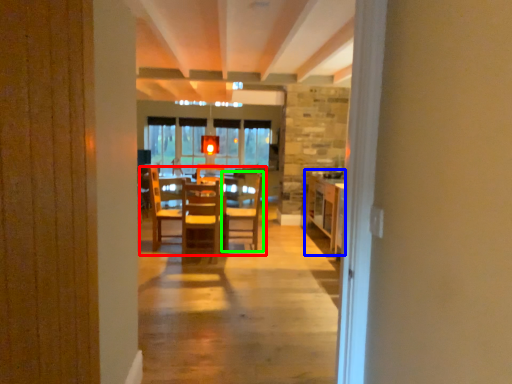
Question: Which object is positioned farthest from table (highlighted by a red box)? Select from table (highlighted by a blue box) and chair (highlighted by a green box).

Choices:
 (A) table
 (B) chair

Answer: (A)